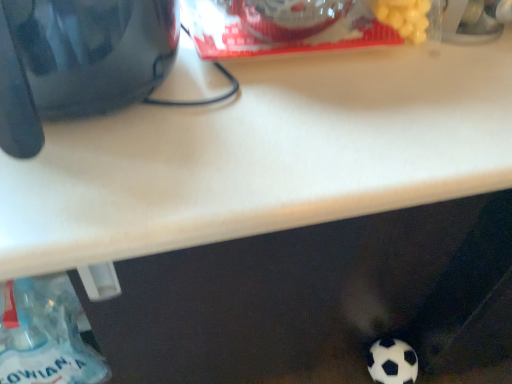
Find the location of a particular element. This screenshot has width=512, height=384. vacant space to the right of glossy black kettle at upper left is located at coordinates tap(310, 131).